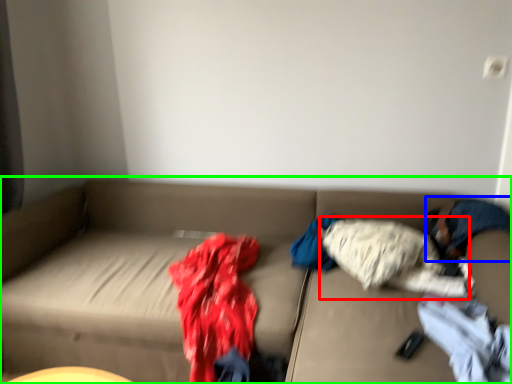
Question: Which object is the closest to the clothing (highlighted by a red box)? Choose among these: person (highlighted by a blue box) or studio couch (highlighted by a green box).

Choices:
 (A) person
 (B) studio couch

Answer: (A)